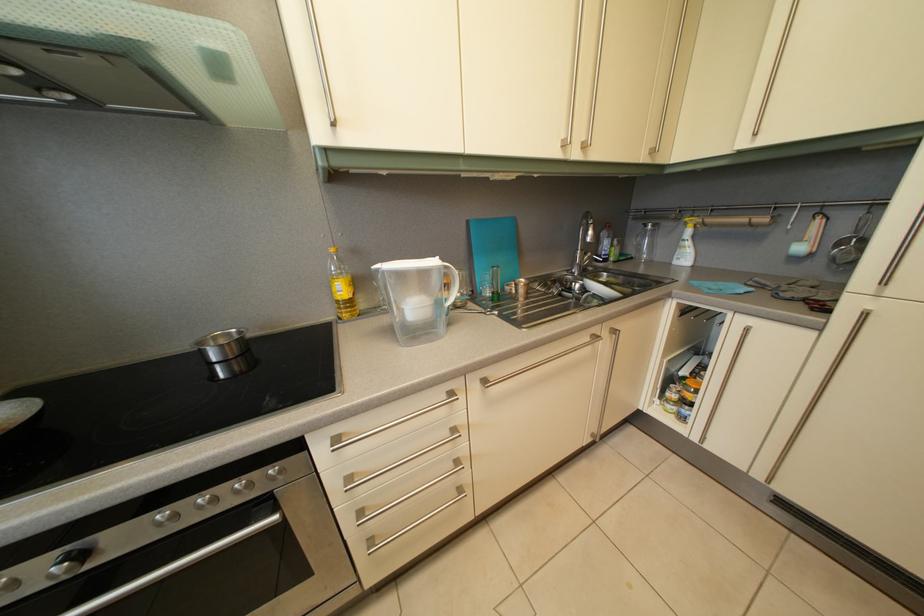
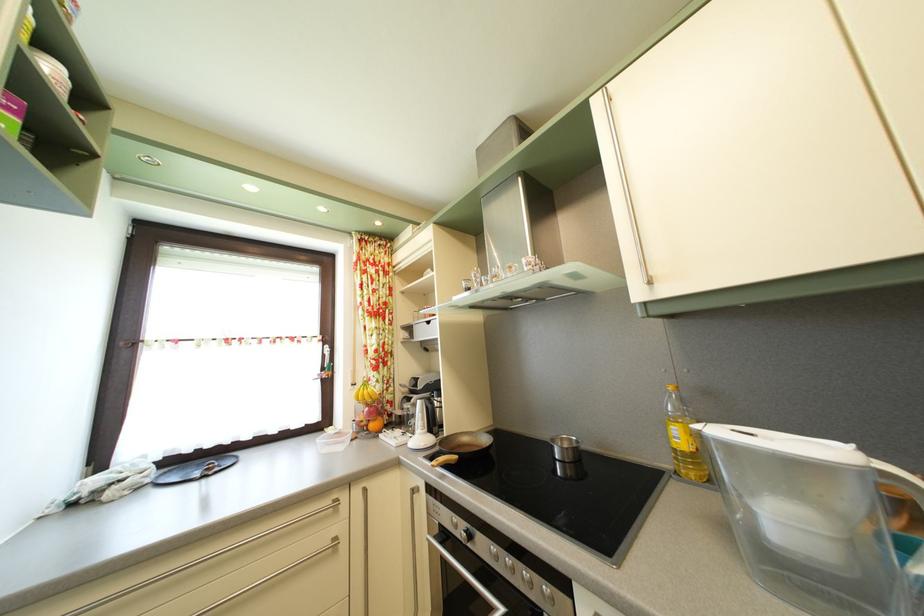
In the second image, find the point that corresponds to pixel 134 545 in the first image.

(490, 553)